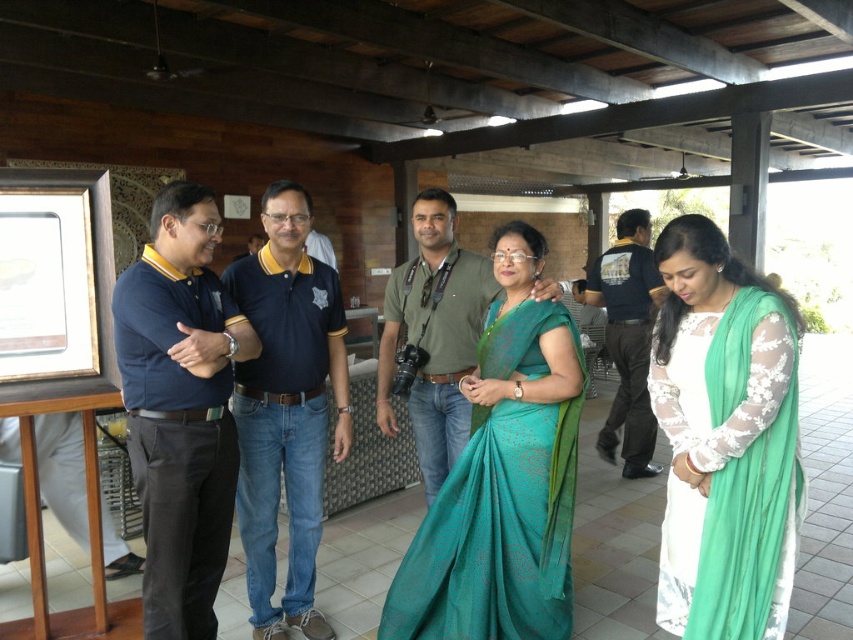
Can you confirm if white lace dress at lower right is positioned to the left of dark blue polo shirt at center?

Incorrect, white lace dress at lower right is not on the left side of dark blue polo shirt at center.

Can you confirm if white lace dress at lower right is taller than dark blue polo shirt at center?

In fact, white lace dress at lower right may be shorter than dark blue polo shirt at center.

Who is more forward, (761, 435) or (262, 456)?

Point (761, 435) is in front.

Identify the location of white lace dress at lower right. The width and height of the screenshot is (853, 640). (724, 440).

Identify the location of teal silk saree at center. (503, 477).

Which is more to the right, dark blue polo shirt at center or dark blue shirt at center?

From the viewer's perspective, dark blue shirt at center appears more on the right side.

The height and width of the screenshot is (640, 853). I want to click on dark blue polo shirt at center, so click(286, 408).